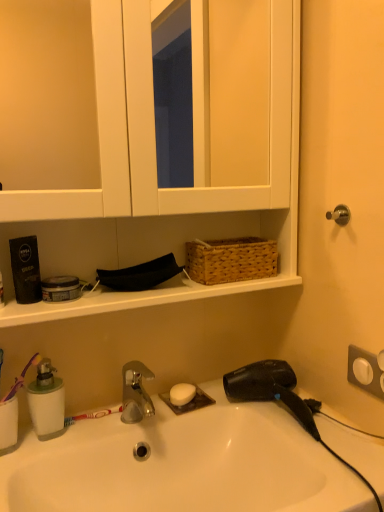
In order to face woven brown basket at upper center, should I rotate leftwards or rightwards?

You should rotate right by 5.148 degrees.

This screenshot has height=512, width=384. Describe the element at coordinates (46, 400) in the screenshot. I see `green translucent soap dispenser at lower left` at that location.

Describe the element at coordinates (182, 464) in the screenshot. I see `white glossy sink at lower center` at that location.

The height and width of the screenshot is (512, 384). What do you see at coordinates (271, 389) in the screenshot?
I see `black plastic hair dryer at lower right` at bounding box center [271, 389].

The image size is (384, 512). What are the coordinates of `black plastic hair dryer at lower right` in the screenshot? It's located at (271, 389).

The image size is (384, 512). What do you see at coordinates (339, 215) in the screenshot?
I see `black metallic door handle at upper right` at bounding box center [339, 215].

Identify the location of white matte soap at center. (182, 394).

Which of these two, white glossy sink at lower center or purple plastic toothbrush at left, is bigger?

Bigger between the two is white glossy sink at lower center.

Consider the image. From a real-world perspective, does white glossy sink at lower center sit lower than purple plastic toothbrush at left?

Indeed, from a real-world perspective, white glossy sink at lower center is positioned beneath purple plastic toothbrush at left.

In the scene shown: Is white glossy sink at lower center not near purple plastic toothbrush at left?

No, there isn't a large distance between white glossy sink at lower center and purple plastic toothbrush at left.

Can you tell me how much white glossy sink at lower center and purple plastic toothbrush at left differ in facing direction?

The facing directions of white glossy sink at lower center and purple plastic toothbrush at left are 1.79 degrees apart.

Does point (334, 213) lie behind point (192, 396)?

That is False.

Which is more to the right, black metallic door handle at upper right or white matte soap at center?

A: black metallic door handle at upper right.

Which object is further away from the camera taking this photo, black metallic door handle at upper right or white matte soap at center?

white matte soap at center.

Which of these two, black metallic door handle at upper right or white matte soap at center, is wider?

With larger width is white matte soap at center.

Can you confirm if black metallic door handle at upper right is thinner than white matte medicine cabinet at upper center?

Yes, black metallic door handle at upper right is thinner than white matte medicine cabinet at upper center.

Which object is positioned more to the left, black metallic door handle at upper right or white matte medicine cabinet at upper center?

white matte medicine cabinet at upper center.

Which object is further away from the camera, black metallic door handle at upper right or white matte medicine cabinet at upper center?

black metallic door handle at upper right is further from the camera.

Is black metallic door handle at upper right oriented towards white matte medicine cabinet at upper center?

No, black metallic door handle at upper right is not facing towards white matte medicine cabinet at upper center.

At what (x,y) coordinates should I click in order to perform the action: click on soap located below the purple plastic toothbrush at left (from the image's perspective). Please return your answer as a coordinate pair (x, y). Looking at the image, I should click on (182, 394).

Looking at this image, is purple plastic toothbrush at left shorter than white matte soap at center?

Incorrect, the height of purple plastic toothbrush at left does not fall short of that of white matte soap at center.

Which is more to the right, purple plastic toothbrush at left or white matte soap at center?

From the viewer's perspective, white matte soap at center appears more on the right side.

Would you say green translucent soap dispenser at lower left is outside white matte soap at center?

Yes, green translucent soap dispenser at lower left is not within white matte soap at center.

Is the surface of green translucent soap dispenser at lower left in direct contact with white matte soap at center?

green translucent soap dispenser at lower left and white matte soap at center are clearly separated.

Considering the points (31, 411) and (191, 390), which point is behind, point (31, 411) or point (191, 390)?

The point (191, 390) is behind.

The image size is (384, 512). Identify the location of soap behind the green translucent soap dispenser at lower left. (182, 394).

Would you consider purple plastic toothbrush at left to be distant from black plastic hair dryer at lower right?

purple plastic toothbrush at left is actually quite close to black plastic hair dryer at lower right.

From a real-world perspective, which is physically below, purple plastic toothbrush at left or black plastic hair dryer at lower right?

black plastic hair dryer at lower right is physically lower.

This screenshot has height=512, width=384. What are the coordinates of `brush in front of the black plastic hair dryer at lower right` in the screenshot? It's located at (21, 377).

Which of these two, purple plastic toothbrush at left or black plastic hair dryer at lower right, is thinner?

Thinner between the two is purple plastic toothbrush at left.

Looking at this image, from a real-world perspective, is white matte medicine cabinet at upper center located beneath purple plastic toothbrush at left?

Incorrect, from a real-world perspective, white matte medicine cabinet at upper center is higher than purple plastic toothbrush at left.

Find the location of `brush below the white matte medicine cabinet at upper center (from a real-world perspective)`. brush below the white matte medicine cabinet at upper center (from a real-world perspective) is located at coordinates (21, 377).

Is white matte medicine cabinet at upper center oriented away from purple plastic toothbrush at left?

white matte medicine cabinet at upper center is not turned away from purple plastic toothbrush at left.

Considering their positions, is white matte medicine cabinet at upper center located in front of or behind purple plastic toothbrush at left?

In the image, white matte medicine cabinet at upper center appears in front of purple plastic toothbrush at left.

The width and height of the screenshot is (384, 512). What are the coordinates of `sink in front of the purple plastic toothbrush at left` in the screenshot? It's located at (182, 464).

Where is `door handle above the white matte soap at center (from the image's perspective)`? door handle above the white matte soap at center (from the image's perspective) is located at coordinates (339, 215).

Based on their spatial positions, is green translucent soap dispenser at lower left or woven brown basket at upper center closer to white matte soap at center?

Based on the image, green translucent soap dispenser at lower left appears to be nearer to white matte soap at center.

When comparing their distances from woven brown basket at upper center, does white glossy sink at lower center or black metallic door handle at upper right seem closer?

black metallic door handle at upper right is positioned closer to the anchor woven brown basket at upper center.

Which object lies further to the anchor point green translucent soap dispenser at lower left, white glossy sink at lower center or white matte medicine cabinet at upper center?

white matte medicine cabinet at upper center.

Looking at the image, which one is located closer to white glossy sink at lower center, white matte medicine cabinet at upper center or black metallic door handle at upper right?

black metallic door handle at upper right is closer to white glossy sink at lower center.

From the image, which object appears to be farther from black plastic hair dryer at lower right, white matte medicine cabinet at upper center or woven brown basket at upper center?

white matte medicine cabinet at upper center is further to black plastic hair dryer at lower right.

Which object lies further to the anchor point purple plastic toothbrush at left, white matte medicine cabinet at upper center or white glossy sink at lower center?

white matte medicine cabinet at upper center is further to purple plastic toothbrush at left.

Which object lies further to the anchor point black metallic door handle at upper right, white glossy sink at lower center or black plastic hair dryer at lower right?

white glossy sink at lower center is positioned further to the anchor black metallic door handle at upper right.

Estimate the real-world distances between objects in this image. Which object is closer to black plastic hair dryer at lower right, black metallic door handle at upper right or white matte soap at center?

Among the two, white matte soap at center is located nearer to black plastic hair dryer at lower right.

Identify the location of soap between green translucent soap dispenser at lower left and black plastic hair dryer at lower right in the horizontal direction. This screenshot has height=512, width=384. (182, 394).

Find the location of a particular element. basket located between purple plastic toothbrush at left and black plastic hair dryer at lower right in the left-right direction is located at coordinates (231, 260).

Where is `door handle between white matte medicine cabinet at upper center and white matte soap at center in the vertical direction`? The width and height of the screenshot is (384, 512). door handle between white matte medicine cabinet at upper center and white matte soap at center in the vertical direction is located at coordinates (339, 215).

Locate an element on the screen. The image size is (384, 512). soap dispenser located between purple plastic toothbrush at left and woven brown basket at upper center in the left-right direction is located at coordinates (46, 400).